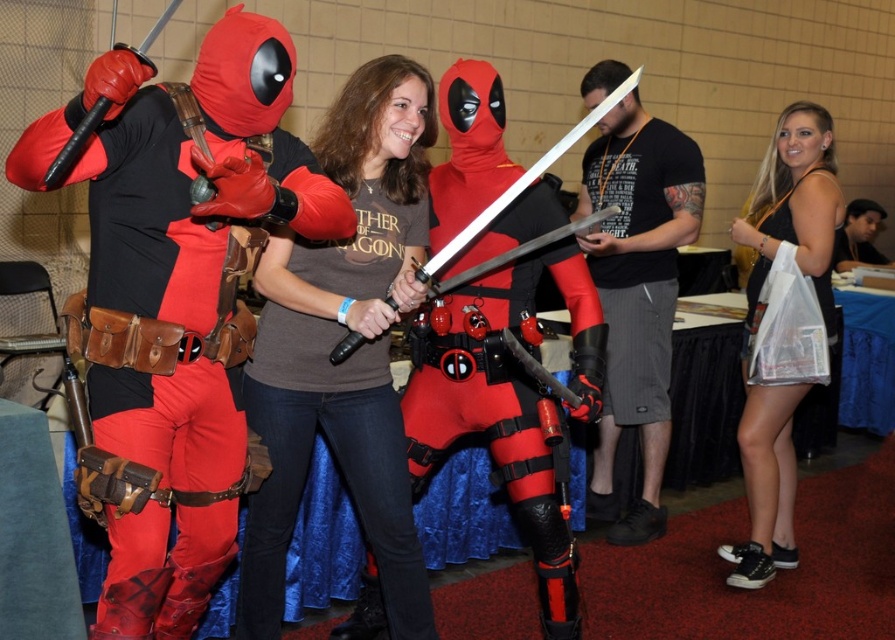
Question: Does matte black sword at center appear over shiny silver sword at center?

Choices:
 (A) yes
 (B) no

Answer: (B)

Question: Among these objects, which one is farthest from the camera?

Choices:
 (A) shiny silver sword at center
 (B) matte red costume at left
 (C) matte black shirt at center
 (D) clear plastic bag at right

Answer: (D)

Question: Is the position of matte black shirt at center less distant than that of shiny silver sword at center?

Choices:
 (A) yes
 (B) no

Answer: (B)

Question: Does matte black shirt at center appear on the left side of clear plastic bag at right?

Choices:
 (A) yes
 (B) no

Answer: (A)

Question: Which point is farther from the camera taking this photo?

Choices:
 (A) (275, 467)
 (B) (774, 182)

Answer: (B)

Question: Which point is closer to the camera taking this photo?

Choices:
 (A) (806, 195)
 (B) (282, 275)

Answer: (B)